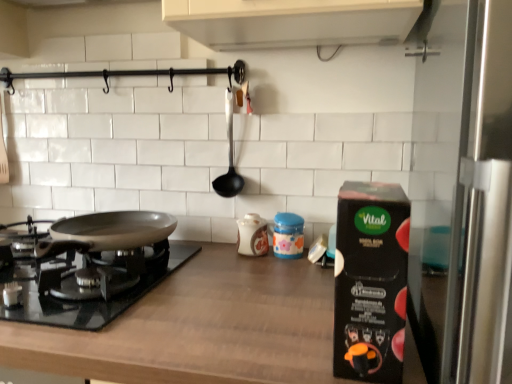
The width and height of the screenshot is (512, 384). In order to click on free space to the back side of black cardboard box at right, which is counted as the 3th kitchen appliance, starting from the left in this screenshot , I will do `click(301, 301)`.